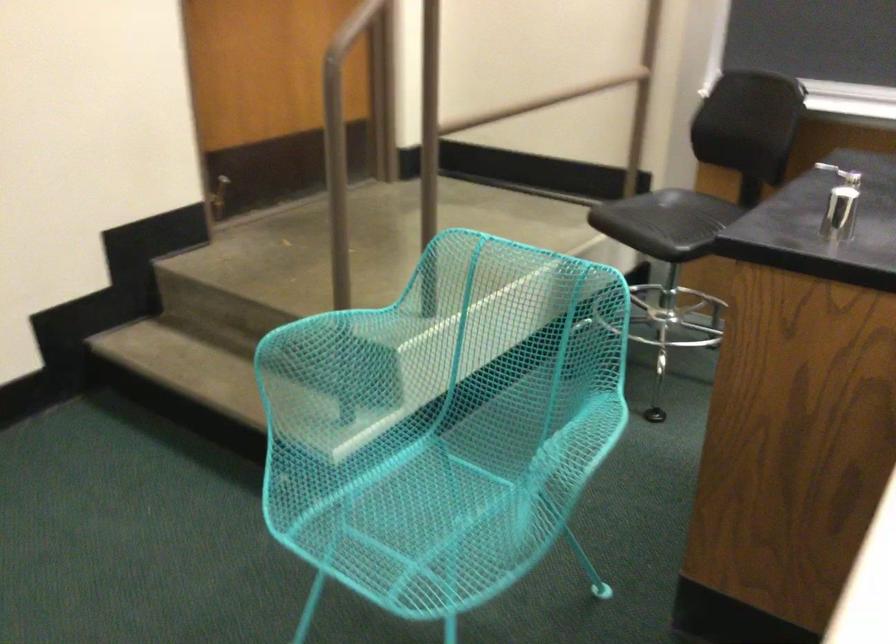
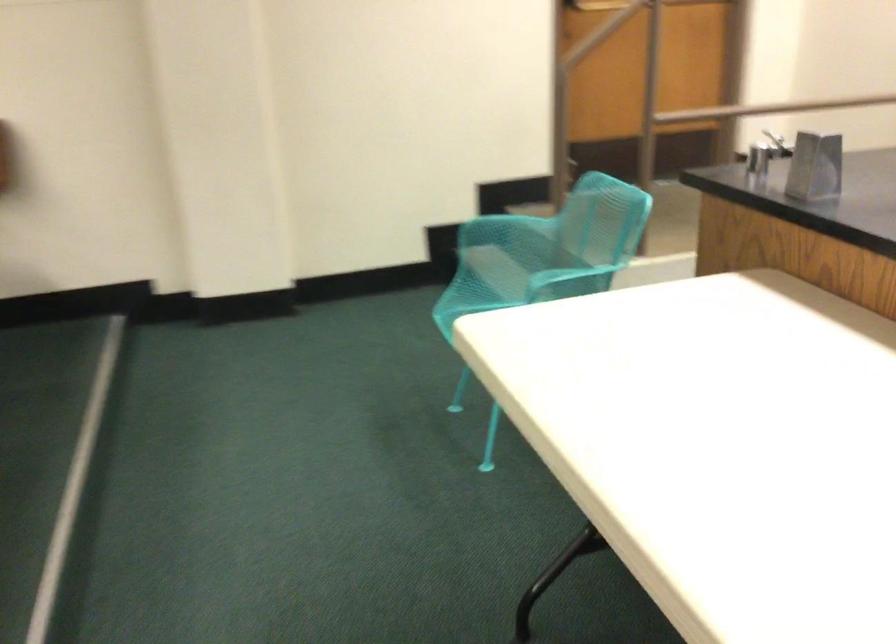
The point at [300,327] is marked in the first image. Where is the corresponding point in the second image?

(494, 218)